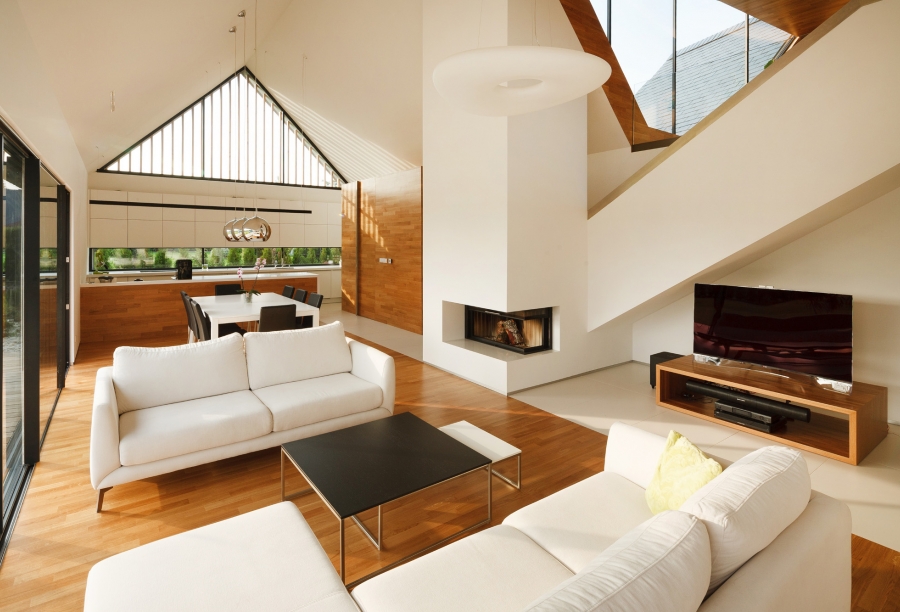
Find the location of a particular element. The image size is (900, 612). chairs is located at coordinates pos(282,310), pos(317,297), pos(302,295), pos(286,289), pos(222,286), pos(196,315), pos(187,308), pos(184,295).